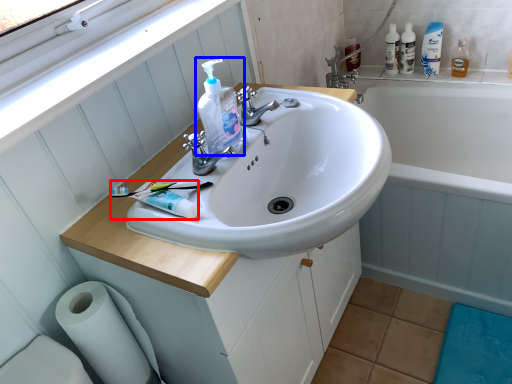
Question: Which point is further to the camera, toothpaste (highlighted by a red box) or cleaning product (highlighted by a blue box)?

Choices:
 (A) toothpaste
 (B) cleaning product

Answer: (B)